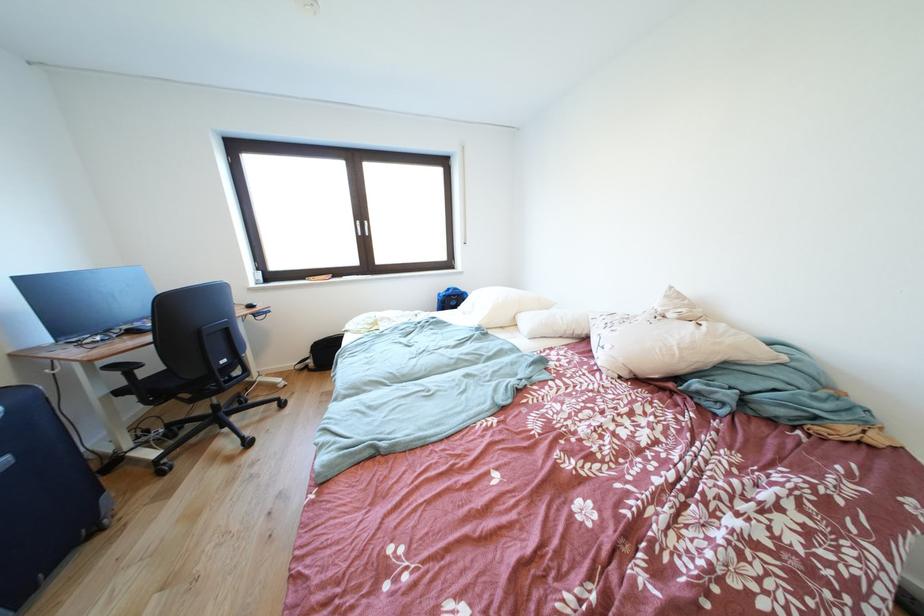
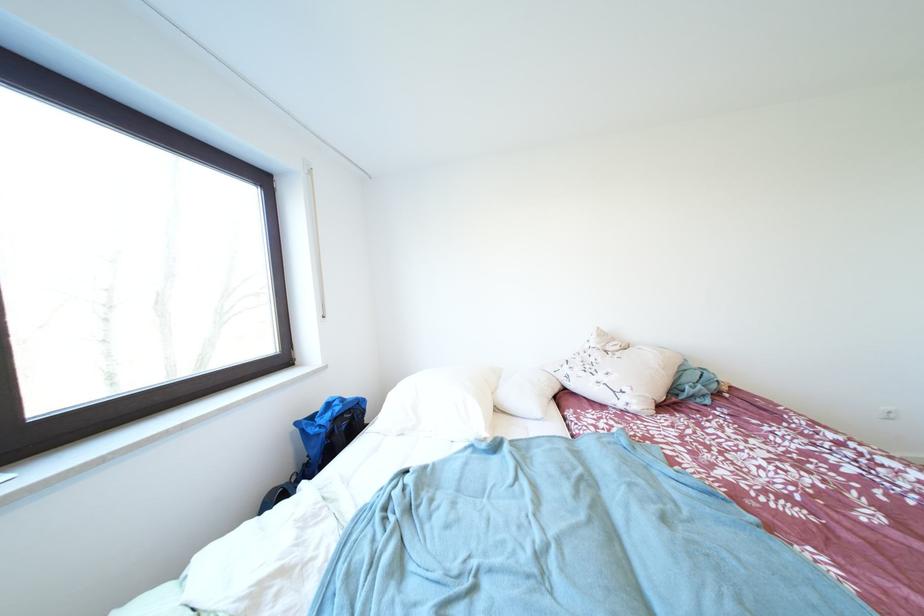
Where in the second image is the point corresponding to point (447, 299) from the first image?

(305, 428)